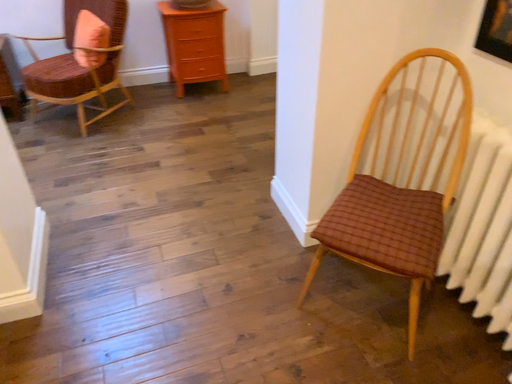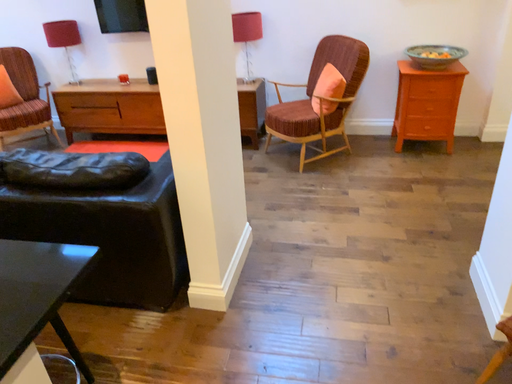
Question: Which way did the camera rotate in the video?

Choices:
 (A) rotated downward
 (B) rotated upward

Answer: (B)